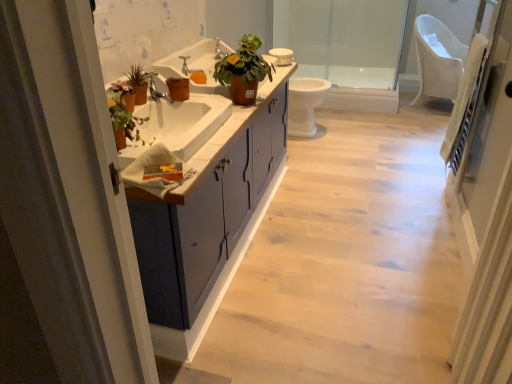
What do you see at coordinates (188, 68) in the screenshot?
I see `matte silver faucet at upper center` at bounding box center [188, 68].

In order to face silver metallic faucet at upper center, the 2th faucet viewed from the front, should I rotate leftwards or rightwards?

Turn left by 4.654 degrees to look at silver metallic faucet at upper center, the 2th faucet viewed from the front.

Find the location of a particular element. This screenshot has width=512, height=384. silver metallic faucet at upper center, positioned as the 2th faucet in bottom-to-top order is located at coordinates (218, 50).

Identify the location of transparent glass shower door at upper center. (342, 39).

In order to click on matte silver faucet at upper center in this screenshot , I will do `click(188, 68)`.

Are matte gray cabinet at center and white glossy toilet at center located far from each other?

That's right, there is a large distance between matte gray cabinet at center and white glossy toilet at center.

How many degrees apart are the facing directions of matte gray cabinet at center and white glossy toilet at center?

matte gray cabinet at center and white glossy toilet at center are facing 1.74 degrees away from each other.

Does matte gray cabinet at center contain white glossy toilet at center?

No.

Is matte gray cabinet at center positioned behind white glossy toilet at center?

No, it is in front of white glossy toilet at center.

Which of these two, transparent glass shower door at upper center or matte silver faucet at upper center, stands taller?

With more height is transparent glass shower door at upper center.

Is transparent glass shower door at upper center looking in the opposite direction of matte silver faucet at upper center?

No, matte silver faucet at upper center is not at the back of transparent glass shower door at upper center.

In the scene shown: Is transparent glass shower door at upper center beside matte silver faucet at upper center?

No, transparent glass shower door at upper center is not beside matte silver faucet at upper center.

This screenshot has width=512, height=384. What are the coordinates of `shower door below the matte silver faucet at upper center (from a real-world perspective)` in the screenshot? It's located at (342, 39).

Consider the image. From the image's perspective, which one is positioned higher, matte white cabinet at center or polished chrome faucet at center, which is counted as the 2th faucet, starting from the top?

From the image's view, polished chrome faucet at center, which is counted as the 2th faucet, starting from the top, is above.

In terms of height, does matte white cabinet at center look taller or shorter compared to polished chrome faucet at center, arranged as the 1th faucet when ordered from the bottom?

matte white cabinet at center is taller than polished chrome faucet at center, arranged as the 1th faucet when ordered from the bottom.

Is polished chrome faucet at center, the first faucet viewed from the left, inside matte white cabinet at center?

No, polished chrome faucet at center, the first faucet viewed from the left, is not inside matte white cabinet at center.

From the image's perspective, which object appears higher, matte white cabinet at center or matte gray cabinet at center?

From the image's view, matte white cabinet at center is above.

Is matte white cabinet at center not near matte gray cabinet at center?

That's not correct — matte white cabinet at center is a little close to matte gray cabinet at center.

Could you tell me if matte white cabinet at center is turned towards matte gray cabinet at center?

No, matte white cabinet at center is not facing towards matte gray cabinet at center.

Does point (196, 189) come closer to viewer compared to point (212, 278)?

Yes, point (196, 189) is closer to viewer.

Considering the points (217, 53) and (152, 89), which point is in front, point (217, 53) or point (152, 89)?

Point (152, 89)

Is silver metallic faucet at upper center, the 2th faucet viewed from the front, far away from polished chrome faucet at center, placed as the 2th faucet when sorted from right to left?

No, silver metallic faucet at upper center, the 2th faucet viewed from the front, is not far from polished chrome faucet at center, placed as the 2th faucet when sorted from right to left.

From a real-world perspective, who is located higher, silver metallic faucet at upper center, the 1th faucet viewed from the back, or polished chrome faucet at center, which is counted as the 2th faucet, starting from the top?

From a 3D spatial view, silver metallic faucet at upper center, the 1th faucet viewed from the back, is above.

Who is taller, silver metallic faucet at upper center, marked as the first faucet in a top-to-bottom arrangement, or polished chrome faucet at center, arranged as the 1th faucet when ordered from the bottom?

Standing taller between the two is silver metallic faucet at upper center, marked as the first faucet in a top-to-bottom arrangement.

Can we say matte terracotta pot at center lies outside transparent glass shower door at upper center?

Yes, matte terracotta pot at center is not within transparent glass shower door at upper center.

Which is more to the left, matte terracotta pot at center or transparent glass shower door at upper center?

matte terracotta pot at center is more to the left.

Does matte terracotta pot at center come in front of transparent glass shower door at upper center?

Yes, it is.

Who is bigger, matte terracotta pot at center or transparent glass shower door at upper center?

With larger size is transparent glass shower door at upper center.

Between silver metallic faucet at upper center, which is the second faucet from left to right, and matte white cabinet at center, which one has larger size?

matte white cabinet at center is bigger.

Is point (216, 58) positioned behind point (225, 123)?

Yes, point (216, 58) is behind point (225, 123).

From the image's perspective, would you say silver metallic faucet at upper center, which is the second faucet from left to right, is shown under matte white cabinet at center?

No, from the image's perspective, silver metallic faucet at upper center, which is the second faucet from left to right, is not beneath matte white cabinet at center.

Image resolution: width=512 pixels, height=384 pixels. What are the coordinates of `cabinetry in front of the white glossy toilet at center` in the screenshot? It's located at (212, 224).

In the image, there is a transparent glass shower door at upper center. Identify the location of tap below it (from the image's perspective). The width and height of the screenshot is (512, 384). (188, 68).

Looking at this image, from the image, which object appears to be farther from white textured screen door at right, matte white cabinet at center or silver metallic faucet at upper center, positioned as the 2th faucet in bottom-to-top order?

silver metallic faucet at upper center, positioned as the 2th faucet in bottom-to-top order, is positioned further to the anchor white textured screen door at right.

Estimate the real-world distances between objects in this image. Which object is closer to white textured screen door at right, transparent glass shower door at upper center or matte silver faucet at upper center?

matte silver faucet at upper center.

When comparing their distances from matte gray cabinet at center, does matte terracotta pot at center or matte silver faucet at upper center seem closer?

matte terracotta pot at center is positioned closer to the anchor matte gray cabinet at center.

Which object lies nearer to the anchor point matte terracotta pot at center, matte gray cabinet at center or polished chrome faucet at center, placed as the 2th faucet when sorted from right to left?

polished chrome faucet at center, placed as the 2th faucet when sorted from right to left, lies closer to matte terracotta pot at center than the other object.

Based on their spatial positions, is matte gray cabinet at center or polished chrome faucet at center, the first faucet viewed from the left, closer to white glossy toilet at center?

matte gray cabinet at center lies closer to white glossy toilet at center than the other object.

When comparing their distances from matte white cabinet at center, does matte terracotta pot at center or transparent glass shower door at upper center seem closer?

matte terracotta pot at center is closer to matte white cabinet at center.

When comparing their distances from matte white cabinet at center, does transparent glass shower door at upper center or silver metallic faucet at upper center, the first faucet viewed from the right, seem closer?

silver metallic faucet at upper center, the first faucet viewed from the right.

Based on their spatial positions, is matte gray cabinet at center or white textured screen door at right closer to matte silver faucet at upper center?

The object closer to matte silver faucet at upper center is matte gray cabinet at center.

This screenshot has height=384, width=512. Find the location of `tap located between matte terracotta pot at center and white glossy toilet at center in the depth direction`. tap located between matte terracotta pot at center and white glossy toilet at center in the depth direction is located at coordinates (188, 68).

Find the location of a particular element. This screenshot has height=384, width=512. houseplant located between white textured screen door at right and matte silver faucet at upper center in the depth direction is located at coordinates (244, 71).

Where is `tap located between white textured screen door at right and white glossy toilet at center in the depth direction`? tap located between white textured screen door at right and white glossy toilet at center in the depth direction is located at coordinates (188, 68).

The height and width of the screenshot is (384, 512). I want to click on tap between matte white cabinet at center and white glossy toilet at center in the front-back direction, so click(188, 68).